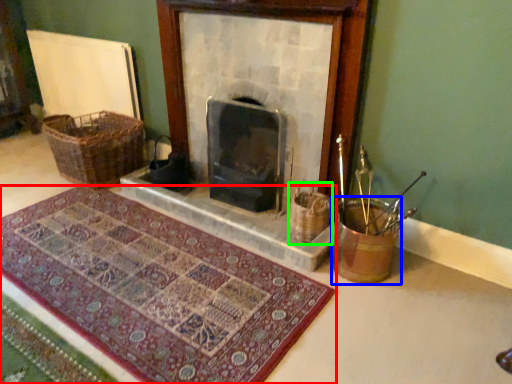
Question: Considering the real-world distances, which object is closest to mat (highlighted by a red box)? basket container (highlighted by a blue box) or basket (highlighted by a green box).

Choices:
 (A) basket container
 (B) basket

Answer: (A)